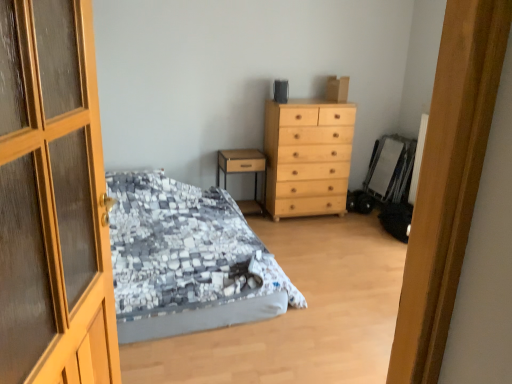
Locate an element on the screen. vacant area that is in front of light wood/texture chest of drawers at center is located at coordinates (310, 233).